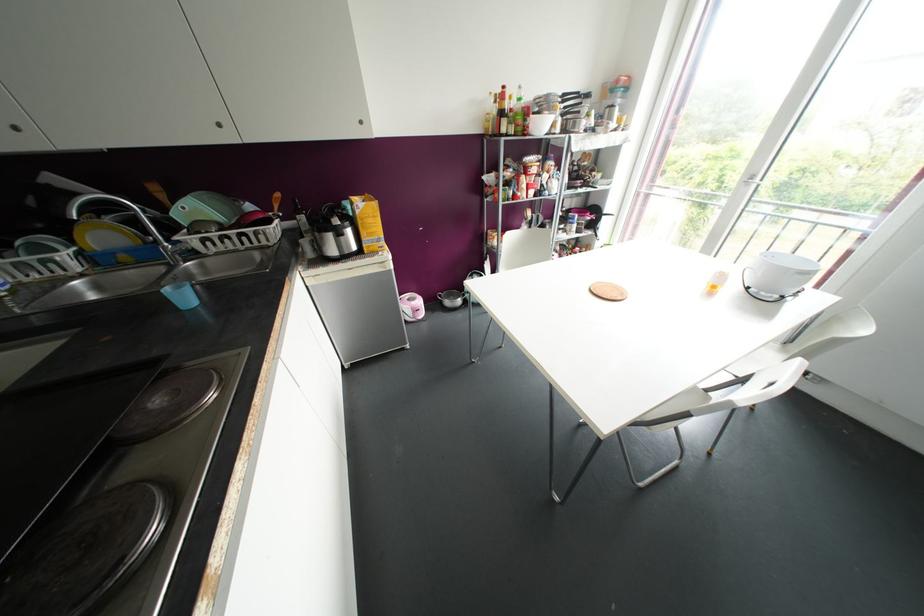
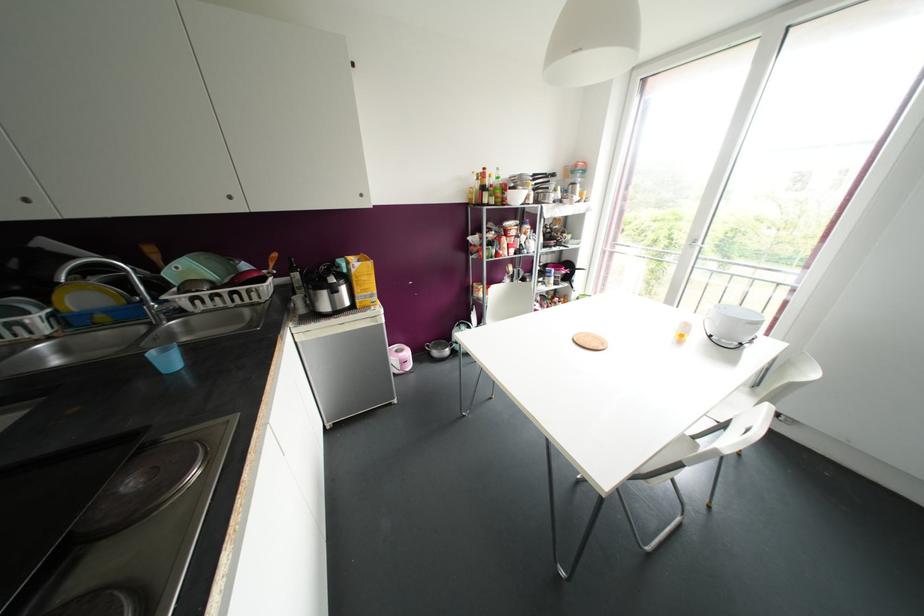
Find the pixel in the second image that matches (782,297) in the first image.

(740, 342)